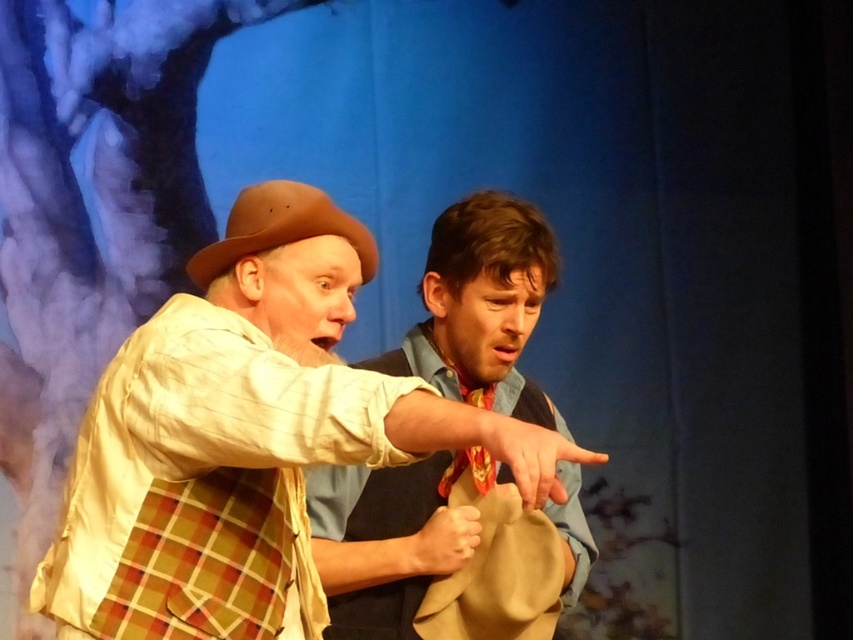
Is point (322, 196) closer to camera compared to point (373, 252)?

Yes, point (322, 196) is closer to viewer.

Can you confirm if matte brown hat at center is positioned below brown felt cowboy hat at left?

Yes.

Which is behind, point (306, 243) or point (281, 205)?

Point (306, 243)

At what (x,y) coordinates should I click in order to perform the action: click on matte brown hat at center. Please return your answer as a coordinate pair (x, y). The height and width of the screenshot is (640, 853). Looking at the image, I should click on (247, 438).